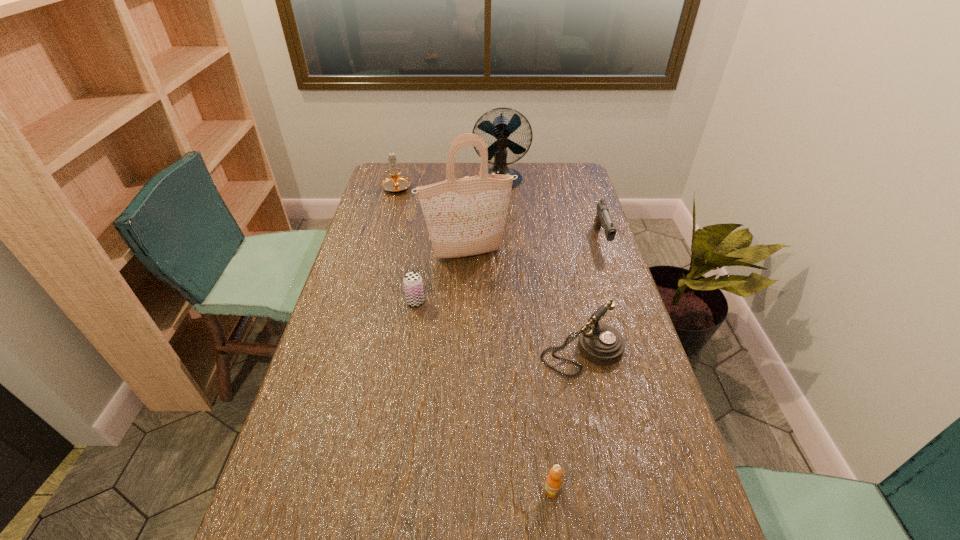
The width and height of the screenshot is (960, 540). What are the coordinates of `shopping bag` in the screenshot? It's located at (466, 216).

Where is `fan`? This screenshot has width=960, height=540. fan is located at coordinates (501, 128).

Locate an element on the screen. the leftmost object is located at coordinates (395, 183).

Locate an element on the screen. candle is located at coordinates (395, 183).

What are the coordinates of `the rightmost object` in the screenshot? It's located at (603, 218).

The height and width of the screenshot is (540, 960). In order to click on telephone in this screenshot , I will do `click(601, 344)`.

Where is `beer can`? beer can is located at coordinates (413, 285).

Locate an element on the screen. This screenshot has width=960, height=540. the nearest object is located at coordinates (553, 483).

Locate an element on the screen. The width and height of the screenshot is (960, 540). vacant space located 0.320m on the back of the shopping bag is located at coordinates (469, 197).

At what (x,y) coordinates should I click in order to perform the action: click on free space located 0.120m on the front-facing side of the sixth shortest object. Please return your answer as a coordinate pair (x, y). Looking at the image, I should click on (502, 211).